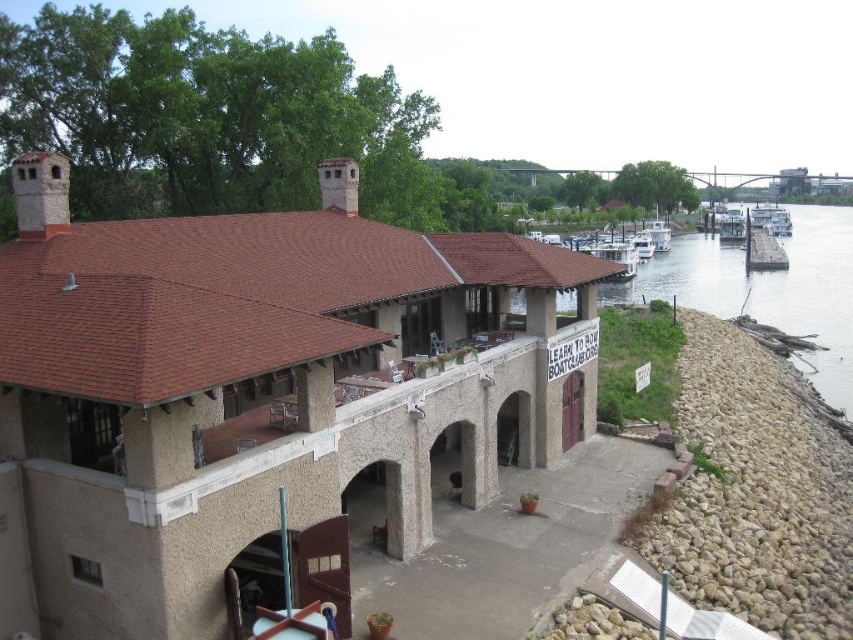
Question: Which point appears closest to the camera in this image?

Choices:
 (A) (647, 228)
 (B) (711, 481)

Answer: (B)

Question: Can you confirm if rocky embankment at lower right is wider than white wooden boat at center right?

Choices:
 (A) yes
 (B) no

Answer: (A)

Question: Which point is closer to the camera?

Choices:
 (A) smooth wooden dock at right
 (B) white wooden boat at center right

Answer: (A)

Question: Is rocky embankment at lower right to the right of white wooden boat at center right from the viewer's perspective?

Choices:
 (A) no
 (B) yes

Answer: (A)

Question: Which object appears closest to the camera in this image?

Choices:
 (A) white glossy boat at lower center
 (B) rocky embankment at lower right

Answer: (B)

Question: Observing the image, what is the correct spatial positioning of smooth wooden dock at right in reference to white wooden boat at center?

Choices:
 (A) left
 (B) right

Answer: (B)